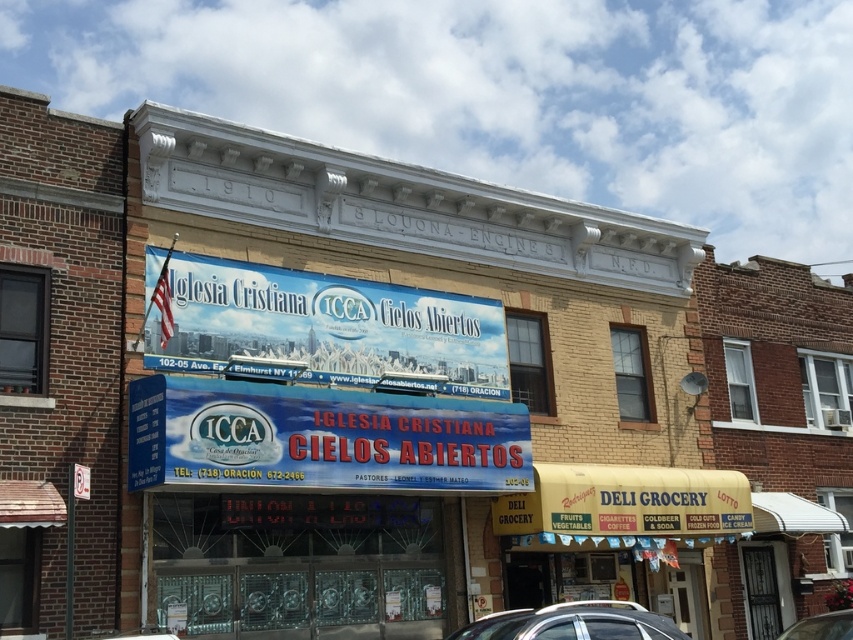
Question: Among these objects, which one is farthest from the camera?

Choices:
 (A) metallic silver car at lower right
 (B) blue fabric sign at center
 (C) blue fabric banner at center
 (D) silver metallic car at lower center

Answer: (C)

Question: Can you confirm if blue fabric sign at center is positioned to the right of blue fabric banner at center?

Choices:
 (A) no
 (B) yes

Answer: (B)

Question: Which object is closer to the camera taking this photo?

Choices:
 (A) blue fabric banner at center
 (B) metallic silver car at lower right

Answer: (B)

Question: Is yellow fabric sign at lower right to the left of metallic silver car at lower right from the viewer's perspective?

Choices:
 (A) no
 (B) yes

Answer: (B)

Question: Among these points, which one is farthest from the camera?

Choices:
 (A) (660, 620)
 (B) (781, 634)
 (C) (498, 301)
 (D) (254, 412)

Answer: (B)

Question: Does blue fabric banner at center have a greater width compared to silver metallic car at lower center?

Choices:
 (A) yes
 (B) no

Answer: (A)